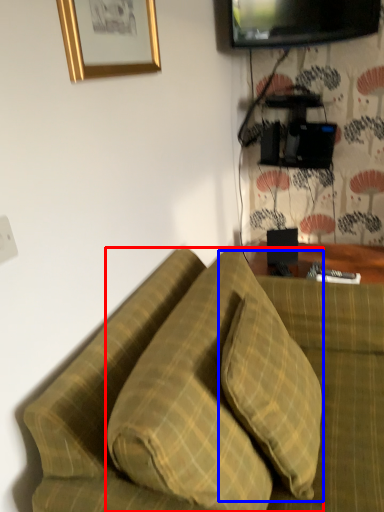
Question: Which object appears closest to the camera in this image, pillow (highlighted by a red box) or pillow (highlighted by a blue box)?

Choices:
 (A) pillow
 (B) pillow

Answer: (A)